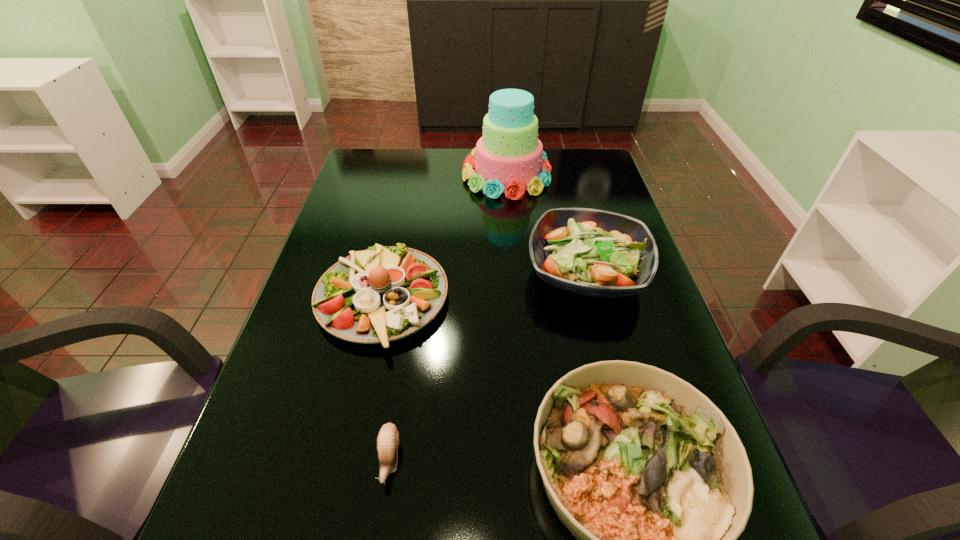
Locate an element on the screen. Image resolution: width=960 pixels, height=540 pixels. object that is at the left edge is located at coordinates (382, 294).

At what (x,y) coordinates should I click in order to perform the action: click on object that is at the right edge. Please return your answer as a coordinate pair (x, y). Looking at the image, I should click on (591, 252).

In the image, there is a desktop. Where is `vacant region at the far edge`? vacant region at the far edge is located at coordinates (445, 159).

In the image, there is a desktop. Where is `free region at the left edge`? free region at the left edge is located at coordinates (329, 225).

You are a GUI agent. You are given a task and a screenshot of the screen. Output one action in this format:
    pyautogui.click(x=<x>, y=<y>)
    Task: Click on the vacant space that is in between the leftmost salad plate and the farthest object
    Image resolution: width=960 pixels, height=540 pixels.
    Given the screenshot: What is the action you would take?
    pyautogui.click(x=444, y=238)

Find the location of a particular element. This screenshot has width=960, height=540. vacant space that's between the leftmost salad plate and the fourth shortest object is located at coordinates (484, 286).

Identify the location of vacant space in between the leftmost salad plate and the farthest object. This screenshot has width=960, height=540. (444, 238).

You are a GUI agent. You are given a task and a screenshot of the screen. Output one action in this format:
    pyautogui.click(x=<x>, y=<y>)
    Task: Click on the free area in between the leftmost salad plate and the tallest salad plate
    
    Given the screenshot: What is the action you would take?
    pyautogui.click(x=484, y=286)

Locate an element on the screen. empty space between the escargot and the leftmost salad plate is located at coordinates (386, 380).

Locate an element on the screen. free space between the escargot and the cake is located at coordinates (448, 317).